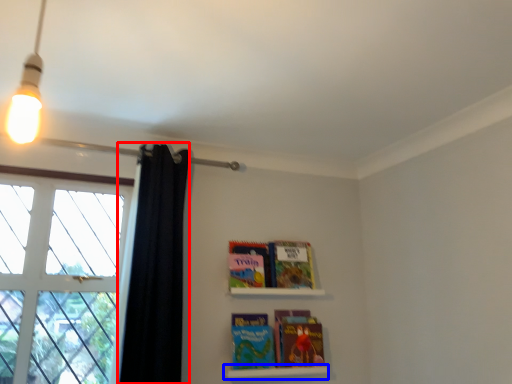
Question: Which object is closer to the camera taking this photo, shower curtain (highlighted by a red box) or shelf (highlighted by a blue box)?

Choices:
 (A) shower curtain
 (B) shelf

Answer: (A)